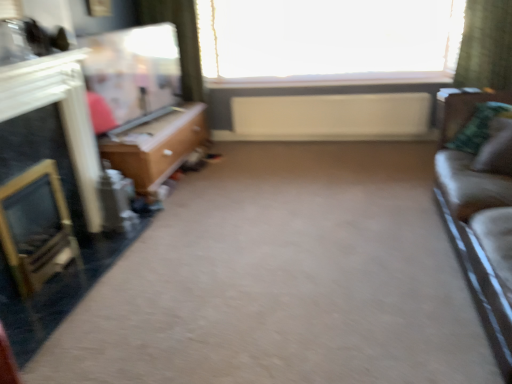
Question: Is white matte radiator at center surrounded by green plaid pillow at right, which appears as the 2th pillow when viewed from the front?

Choices:
 (A) no
 (B) yes

Answer: (A)

Question: From the image's perspective, is green plaid pillow at right, which appears as the 2th pillow when viewed from the front, on white matte radiator at center?

Choices:
 (A) yes
 (B) no

Answer: (B)

Question: From a real-world perspective, is green plaid pillow at right, the first pillow from the back, positioned over white matte radiator at center based on gravity?

Choices:
 (A) yes
 (B) no

Answer: (A)

Question: Is green plaid pillow at right, which appears as the 2th pillow when viewed from the front, thinner than white matte radiator at center?

Choices:
 (A) no
 (B) yes

Answer: (A)

Question: Does green plaid pillow at right, the first pillow from the back, appear on the right side of white matte radiator at center?

Choices:
 (A) yes
 (B) no

Answer: (A)

Question: Considering the positions of green plaid pillow at right, which appears as the 2th pillow when viewed from the front, and white glossy fireplace at left in the image, is green plaid pillow at right, which appears as the 2th pillow when viewed from the front, bigger or smaller than white glossy fireplace at left?

Choices:
 (A) small
 (B) big

Answer: (A)

Question: From the image's perspective, is green plaid pillow at right, which appears as the 2th pillow when viewed from the front, above or below white glossy fireplace at left?

Choices:
 (A) above
 (B) below

Answer: (A)

Question: Is point (501, 104) positioned closer to the camera than point (62, 56)?

Choices:
 (A) farther
 (B) closer

Answer: (A)

Question: Is green plaid pillow at right, which appears as the 2th pillow when viewed from the front, taller or shorter than white glossy fireplace at left?

Choices:
 (A) short
 (B) tall

Answer: (A)

Question: Is leather couch at right taller or shorter than green plaid pillow at right, which appears as the 2th pillow when viewed from the front?

Choices:
 (A) short
 (B) tall

Answer: (B)

Question: From a real-world perspective, relative to green plaid pillow at right, the first pillow from the back, is leather couch at right vertically above or below?

Choices:
 (A) below
 (B) above

Answer: (A)

Question: From the image's perspective, is leather couch at right located above or below green plaid pillow at right, which appears as the 2th pillow when viewed from the front?

Choices:
 (A) below
 (B) above

Answer: (A)

Question: Is leather couch at right wider or thinner than green plaid pillow at right, which appears as the 2th pillow when viewed from the front?

Choices:
 (A) thin
 (B) wide

Answer: (B)

Question: Considering the relative positions of transparent glass window at upper center and green fabric pillow at right, which ranks as the 2th pillow in back-to-front order, in the image provided, is transparent glass window at upper center to the left or to the right of green fabric pillow at right, which ranks as the 2th pillow in back-to-front order,?

Choices:
 (A) right
 (B) left

Answer: (B)

Question: In terms of height, does transparent glass window at upper center look taller or shorter compared to green fabric pillow at right, arranged as the 1th pillow when viewed from the front?

Choices:
 (A) tall
 (B) short

Answer: (A)